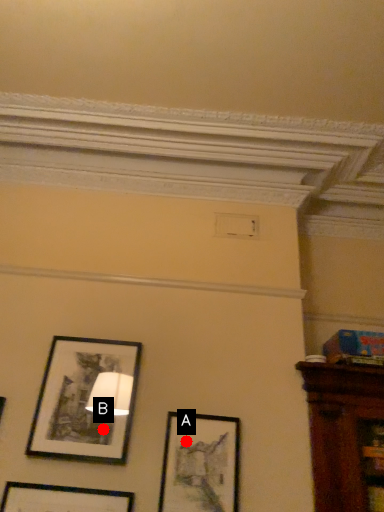
Question: Two points are circled on the image, labeled by A and B beside each circle. Which point is farther from the camera taking this photo?

Choices:
 (A) A is further
 (B) B is further

Answer: (B)